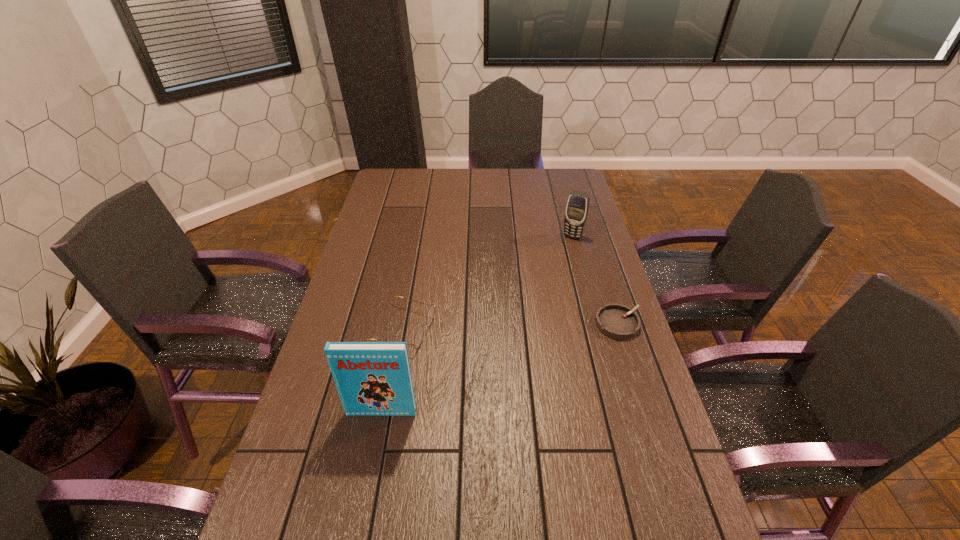
This screenshot has width=960, height=540. In order to click on vacant space situated 0.350m on the temples of the spectacles in this screenshot , I will do `click(551, 362)`.

You are a GUI agent. You are given a task and a screenshot of the screen. Output one action in this format:
    pyautogui.click(x=<x>, y=<y>)
    Task: Click on the vacant area located on the front face of the cellular telephone
    This screenshot has width=960, height=540.
    Given the screenshot: What is the action you would take?
    pyautogui.click(x=543, y=286)

In order to click on blank space located on the front face of the cellular telephone in this screenshot , I will do `click(564, 251)`.

Where is `vacant space located on the front face of the cellular telephone`? This screenshot has height=540, width=960. vacant space located on the front face of the cellular telephone is located at coordinates (547, 279).

Image resolution: width=960 pixels, height=540 pixels. I want to click on book that is at the left edge, so click(x=372, y=378).

I want to click on spectacles situated at the left edge, so click(x=418, y=338).

The image size is (960, 540). Identify the location of ashtray situated at the right edge. (616, 321).

At what (x,y) coordinates should I click in order to perform the action: click on cellular telephone present at the right edge. Please return your answer as a coordinate pair (x, y). Looking at the image, I should click on (577, 207).

Find the location of a particular element. The width and height of the screenshot is (960, 540). vacant space at the far edge is located at coordinates (479, 183).

Identify the location of vacant space at the left edge of the desktop. (358, 273).